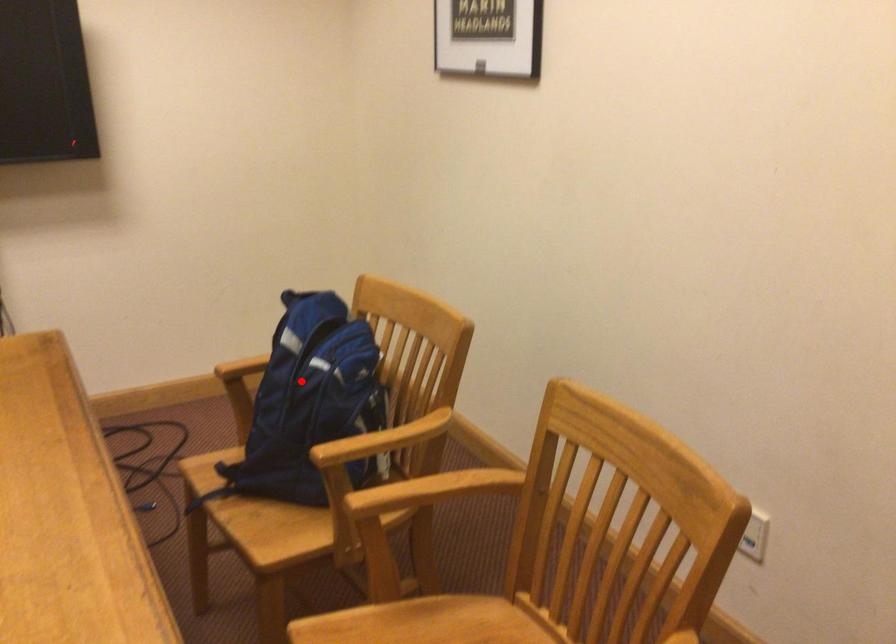
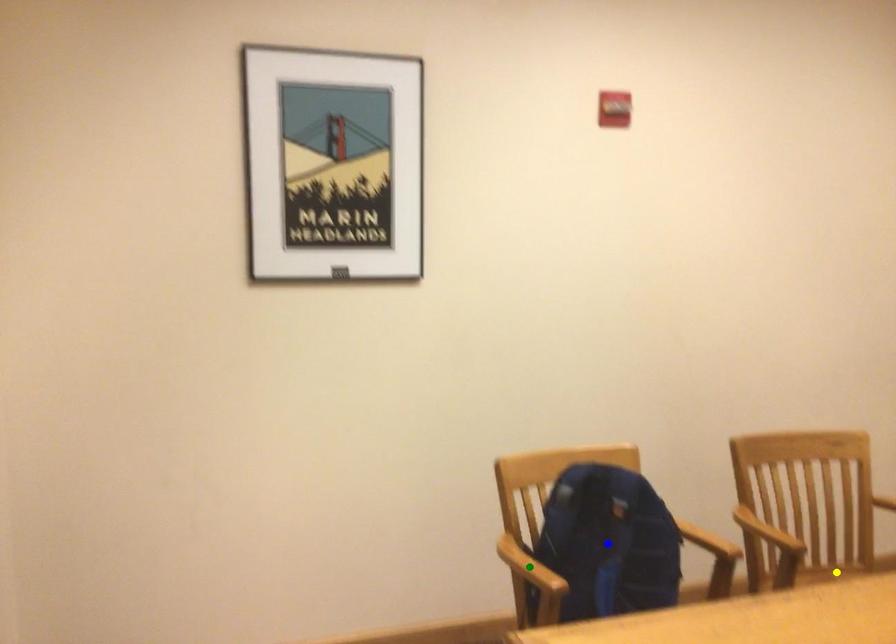
Question: I am providing you with two images of the same scene from different viewpoints. A red point is marked on the first image. You are given multiple points on the second image. In image 2, which mark is for the same physical point as the one in image 1?

Choices:
 (A) yellow point
 (B) blue point
 (C) green point

Answer: (B)